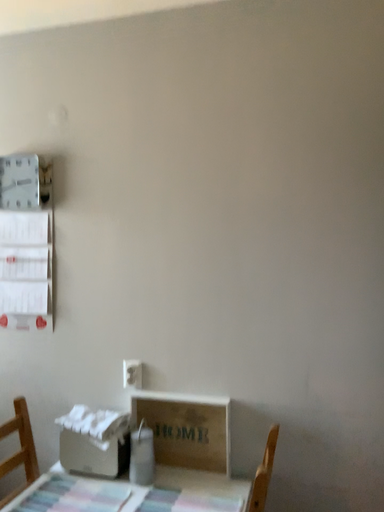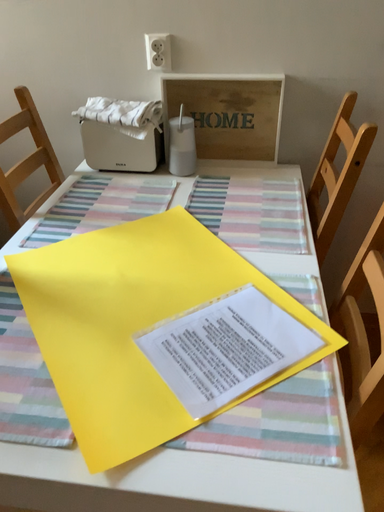
Question: Which way did the camera rotate in the video?

Choices:
 (A) rotated downward
 (B) rotated upward

Answer: (A)